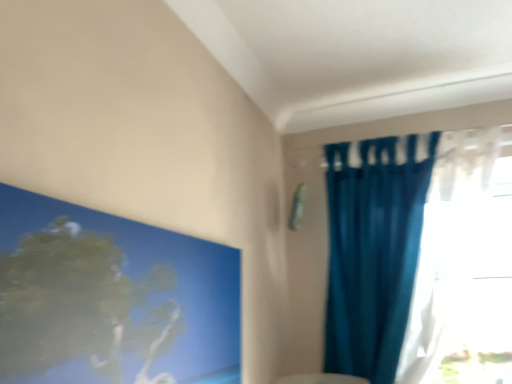
Where is `teal fabric curtain at right`? This screenshot has width=512, height=384. teal fabric curtain at right is located at coordinates (413, 246).

Measure the distance between point (368, 375) and camera.

The distance of point (368, 375) from camera is 4.59 feet.

This screenshot has width=512, height=384. What do you see at coordinates (413, 246) in the screenshot? I see `teal fabric curtain at right` at bounding box center [413, 246].

Locate an element on the screen. The width and height of the screenshot is (512, 384). smooth blue painting at upper left is located at coordinates (79, 305).

Describe the element at coordinates (79, 305) in the screenshot. I see `smooth blue painting at upper left` at that location.

Where is `teal fabric curtain at right`? The image size is (512, 384). teal fabric curtain at right is located at coordinates (413, 246).

Does smooth blue painting at upper left appear on the right side of teal fabric curtain at right?

Incorrect, smooth blue painting at upper left is not on the right side of teal fabric curtain at right.

Which object is closer to the camera, smooth blue painting at upper left or teal fabric curtain at right?

smooth blue painting at upper left is more forward.

Which is farther, (179, 326) or (338, 151)?

The point (338, 151) is behind.

From the image's perspective, is smooth blue painting at upper left located beneath teal fabric curtain at right?

Yes.

From a real-world perspective, who is located higher, smooth blue painting at upper left or teal fabric curtain at right?

From a 3D spatial view, teal fabric curtain at right is above.

Considering the sizes of objects smooth blue painting at upper left and teal fabric curtain at right in the image provided, who is wider, smooth blue painting at upper left or teal fabric curtain at right?

Wider between the two is teal fabric curtain at right.

Which of these two, smooth blue painting at upper left or teal fabric curtain at right, stands shorter?

With less height is smooth blue painting at upper left.

Between smooth blue painting at upper left and teal fabric curtain at right, which one has larger size?

teal fabric curtain at right is bigger.

Is smooth blue painting at upper left inside the boundaries of teal fabric curtain at right, or outside?

smooth blue painting at upper left is not enclosed by teal fabric curtain at right.

Is smooth blue painting at upper left not close to teal fabric curtain at right?

smooth blue painting at upper left is actually quite close to teal fabric curtain at right.

Is smooth blue painting at upper left turned away from teal fabric curtain at right?

No, smooth blue painting at upper left's orientation is not away from teal fabric curtain at right.

How many degrees apart are the facing directions of smooth blue painting at upper left and teal fabric curtain at right?

The angle between the facing direction of smooth blue painting at upper left and the facing direction of teal fabric curtain at right is 89.7 degrees.

Where is `curtain above the smooth blue painting at upper left (from the image's perspective)`? The image size is (512, 384). curtain above the smooth blue painting at upper left (from the image's perspective) is located at coordinates (413, 246).

Can you confirm if teal fabric curtain at right is positioned to the left of smooth blue painting at upper left?

No, teal fabric curtain at right is not to the left of smooth blue painting at upper left.

Is teal fabric curtain at right closer to camera compared to smooth blue painting at upper left?

No, teal fabric curtain at right is behind smooth blue painting at upper left.

Which is behind, point (453, 287) or point (22, 260)?

The point (453, 287) is more distant.

In the scene shown: From the image's perspective, relative to smooth blue painting at upper left, is teal fabric curtain at right above or below?

teal fabric curtain at right is situated higher than smooth blue painting at upper left in the image.

From a real-world perspective, does teal fabric curtain at right sit lower than smooth blue painting at upper left?

No, from a real-world perspective, teal fabric curtain at right is not beneath smooth blue painting at upper left.

Is teal fabric curtain at right thinner than smooth blue painting at upper left?

Incorrect, the width of teal fabric curtain at right is not less than that of smooth blue painting at upper left.

Which of these two, teal fabric curtain at right or smooth blue painting at upper left, stands shorter?

With less height is smooth blue painting at upper left.

Which of these two, teal fabric curtain at right or smooth blue painting at upper left, is bigger?

Bigger between the two is teal fabric curtain at right.

In the scene shown: Is teal fabric curtain at right completely or partially outside of smooth blue painting at upper left?

Yes.

Is teal fabric curtain at right not near smooth blue painting at upper left?

They are positioned close to each other.

Does teal fabric curtain at right turn towards smooth blue painting at upper left?

Yes, teal fabric curtain at right is turned towards smooth blue painting at upper left.

How distant is teal fabric curtain at right from smooth blue painting at upper left?

The distance of teal fabric curtain at right from smooth blue painting at upper left is 38.04 inches.

At what (x,y) coordinates should I click in order to perform the action: click on tree in front of the teal fabric curtain at right. Please return your answer as a coordinate pair (x, y). The width and height of the screenshot is (512, 384). Looking at the image, I should click on (79, 305).

The height and width of the screenshot is (384, 512). I want to click on tree on the left of teal fabric curtain at right, so click(x=79, y=305).

At what (x,y) coordinates should I click in order to perform the action: click on tree located in front of the teal fabric curtain at right. Please return your answer as a coordinate pair (x, y). The height and width of the screenshot is (384, 512). Looking at the image, I should click on (79, 305).